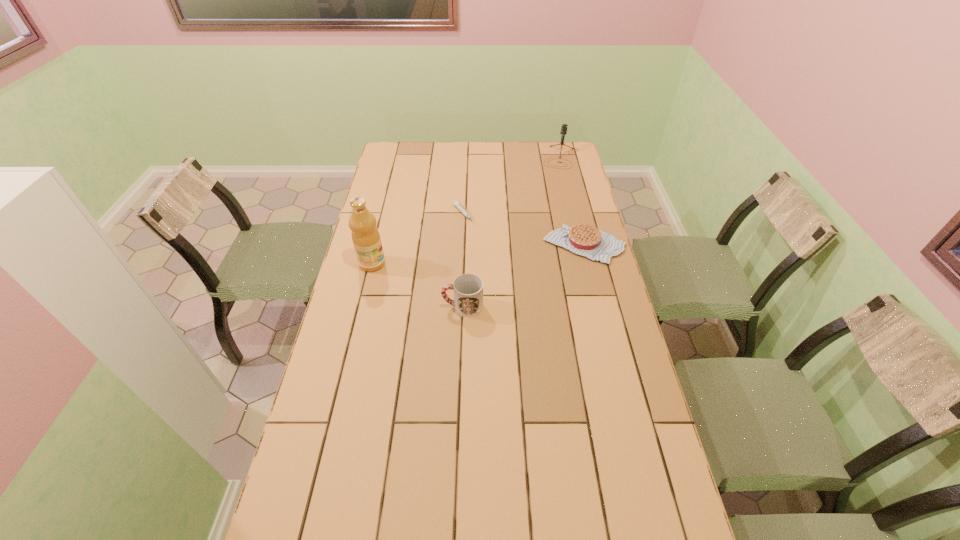
Find the location of a particular element. free space that satisfies the following two spatial constraints: 1. on the back side of the olive oil; 2. on the left side of the shortest object is located at coordinates (384, 214).